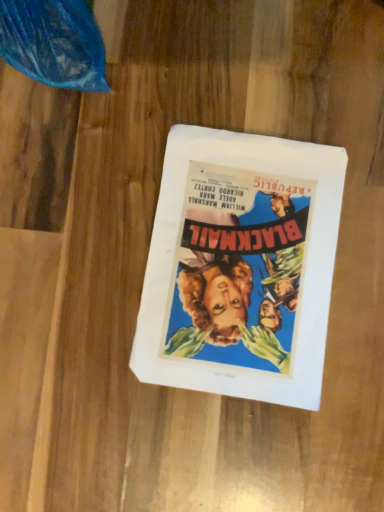
Where is `vacant region above matte paper book at center (from a real-world perspective)`? vacant region above matte paper book at center (from a real-world perspective) is located at coordinates (240, 259).